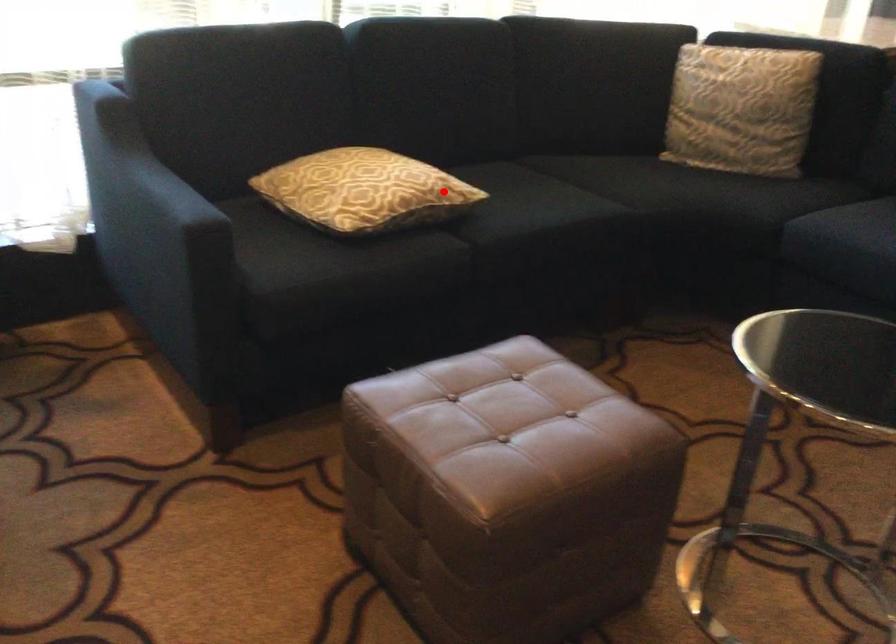
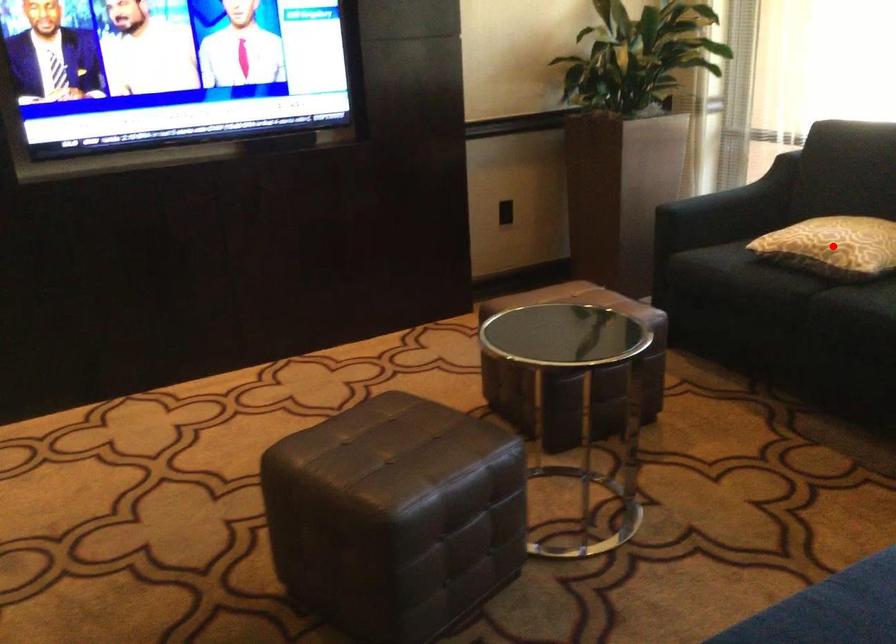
I am providing you with two images of the same scene from different viewpoints. A red point is marked on the first image and another point is marked on the second image. Are the points marked in image1 and image2 representing the same 3D position?

Yes